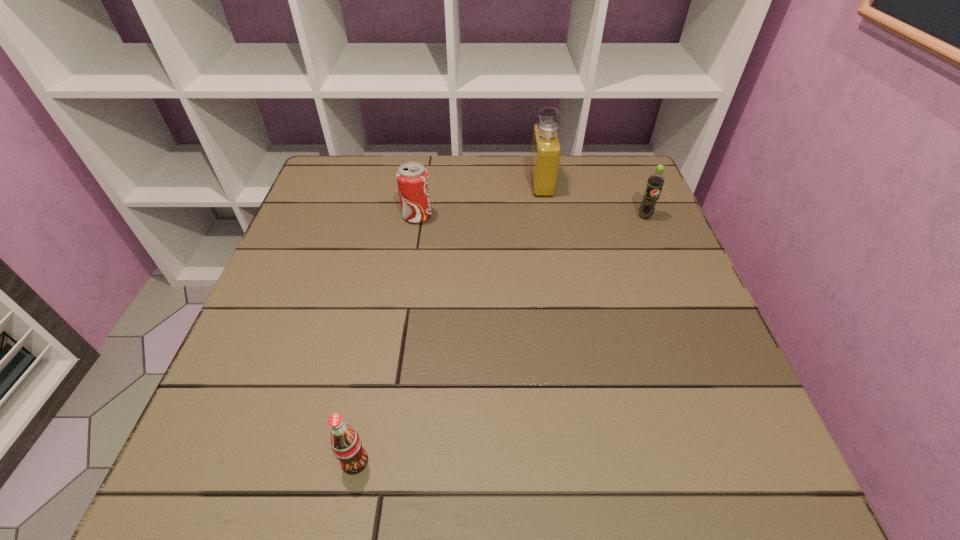
Locate an element on the screen. Image resolution: width=960 pixels, height=540 pixels. unoccupied area between the rightmost soda and the nearest soda is located at coordinates (500, 339).

In order to click on free spot between the farthest object and the rightmost soda in this screenshot , I will do `click(593, 200)`.

The image size is (960, 540). What are the coordinates of `vacant area that lies between the second object from right to left and the rightmost object` in the screenshot? It's located at (593, 200).

Identify the location of unoccupied position between the rightmost soda and the nearest soda. This screenshot has height=540, width=960. (500, 339).

Select which object is the third closest to the nearest soda. Please provide its 2D coordinates. Your answer should be formatted as a tuple, i.e. [(x, y)], where the tuple contains the x and y coordinates of a point satisfying the conditions above.

[(655, 182)]

Identify which object is located as the third nearest to the rightmost soda. Please provide its 2D coordinates. Your answer should be formatted as a tuple, i.e. [(x, y)], where the tuple contains the x and y coordinates of a point satisfying the conditions above.

[(346, 444)]

The height and width of the screenshot is (540, 960). What are the coordinates of `soda that is the nearest to the nearest soda` in the screenshot? It's located at click(412, 178).

In order to click on soda that is the closest to the rightmost soda in this screenshot , I will do `click(412, 178)`.